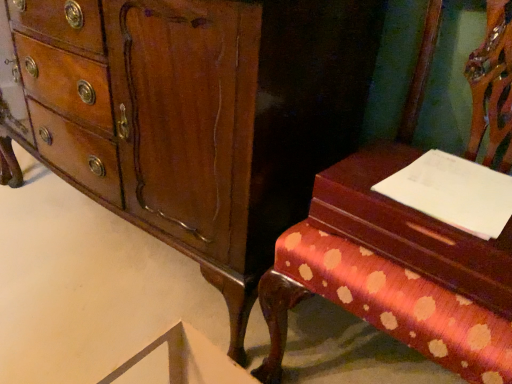
Question: Does mahogany wood chest of drawers at center have a smaller size compared to polka dot fabric bench at right?

Choices:
 (A) no
 (B) yes

Answer: (A)

Question: Could you tell me if mahogany wood chest of drawers at center is facing polka dot fabric bench at right?

Choices:
 (A) yes
 (B) no

Answer: (B)

Question: Is polka dot fabric bench at right at the back of mahogany wood chest of drawers at center?

Choices:
 (A) no
 (B) yes

Answer: (A)

Question: Are mahogany wood chest of drawers at center and polka dot fabric bench at right far apart?

Choices:
 (A) no
 (B) yes

Answer: (A)

Question: Does mahogany wood chest of drawers at center appear on the right side of polka dot fabric bench at right?

Choices:
 (A) no
 (B) yes

Answer: (A)

Question: From the image's perspective, is wooden vanity at right positioned above or below white paper at right?

Choices:
 (A) below
 (B) above

Answer: (A)

Question: From a real-world perspective, relative to white paper at right, is wooden vanity at right vertically above or below?

Choices:
 (A) below
 (B) above

Answer: (A)

Question: Do you think wooden vanity at right is within white paper at right, or outside of it?

Choices:
 (A) outside
 (B) inside

Answer: (A)

Question: Based on their sizes in the image, would you say wooden vanity at right is bigger or smaller than white paper at right?

Choices:
 (A) small
 (B) big

Answer: (B)

Question: From the image's perspective, is mahogany wood chest of drawers at center positioned above or below polka dot fabric bench at right?

Choices:
 (A) above
 (B) below

Answer: (A)

Question: Looking at their shapes, would you say mahogany wood chest of drawers at center is wider or thinner than polka dot fabric bench at right?

Choices:
 (A) thin
 (B) wide

Answer: (A)

Question: Is point (231, 263) closer or farther from the camera than point (373, 198)?

Choices:
 (A) farther
 (B) closer

Answer: (A)

Question: From a real-world perspective, relative to polka dot fabric bench at right, is mahogany wood chest of drawers at center vertically above or below?

Choices:
 (A) above
 (B) below

Answer: (B)

Question: Does point (483, 94) appear closer or farther from the camera than point (462, 240)?

Choices:
 (A) closer
 (B) farther

Answer: (B)

Question: Would you say polka dot fabric bench at right is inside or outside wooden vanity at right?

Choices:
 (A) outside
 (B) inside

Answer: (A)